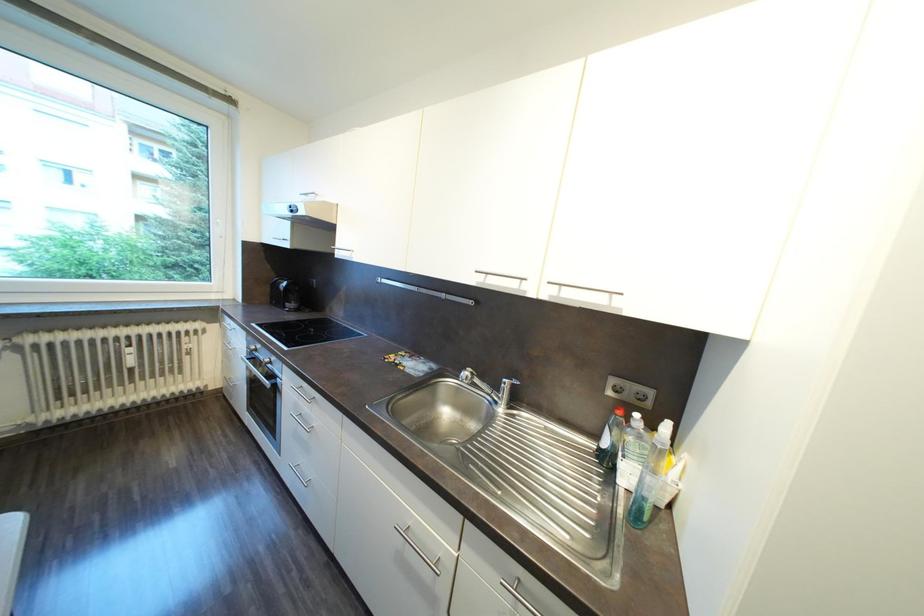
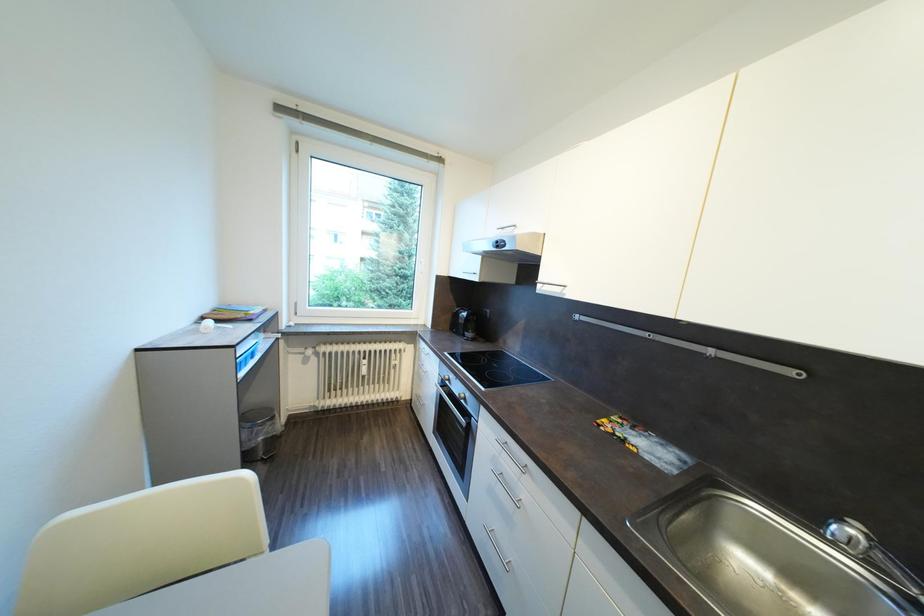
Question: The first image is from the beginning of the video and the second image is from the end. How did the camera likely rotate when shooting the video?

Choices:
 (A) Left
 (B) Right
 (C) Up
 (D) Down

Answer: (A)